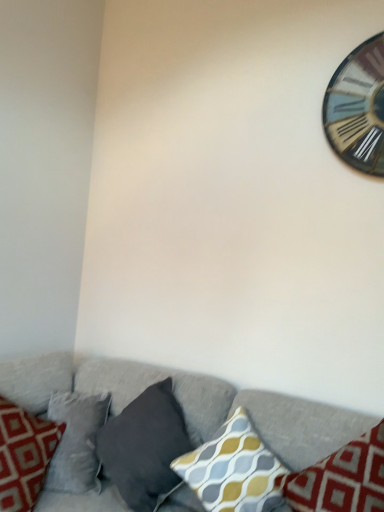
Question: Could you tell me if textured gray couch at lower center is turned towards wooden clock at upper right?

Choices:
 (A) no
 (B) yes

Answer: (A)

Question: Is textured gray couch at lower center to the left of wooden clock at upper right from the viewer's perspective?

Choices:
 (A) no
 (B) yes

Answer: (B)

Question: Considering the relative sizes of textured gray couch at lower center and wooden clock at upper right in the image provided, is textured gray couch at lower center taller than wooden clock at upper right?

Choices:
 (A) yes
 (B) no

Answer: (A)

Question: Is textured gray couch at lower center completely or partially outside of wooden clock at upper right?

Choices:
 (A) yes
 (B) no

Answer: (A)

Question: From a real-world perspective, is textured gray couch at lower center on top of wooden clock at upper right?

Choices:
 (A) no
 (B) yes

Answer: (A)

Question: Would you consider textured gray couch at lower center to be distant from wooden clock at upper right?

Choices:
 (A) no
 (B) yes

Answer: (B)

Question: Is wooden clock at upper right shorter than yellow-gray patterned cushion at center, the second pillow from the right?

Choices:
 (A) no
 (B) yes

Answer: (A)

Question: Is wooden clock at upper right facing away from yellow-gray patterned cushion at center, arranged as the second pillow when viewed from the left?

Choices:
 (A) no
 (B) yes

Answer: (A)

Question: Is the position of wooden clock at upper right less distant than that of yellow-gray patterned cushion at center, arranged as the second pillow when viewed from the left?

Choices:
 (A) yes
 (B) no

Answer: (B)

Question: Can you confirm if wooden clock at upper right is taller than yellow-gray patterned cushion at center, the second pillow from the right?

Choices:
 (A) no
 (B) yes

Answer: (B)

Question: Would you consider wooden clock at upper right to be distant from yellow-gray patterned cushion at center, the second pillow from the right?

Choices:
 (A) no
 (B) yes

Answer: (B)

Question: Is wooden clock at upper right facing towards yellow-gray patterned cushion at center, arranged as the second pillow when viewed from the left?

Choices:
 (A) no
 (B) yes

Answer: (A)

Question: Considering the relative positions of yellow-gray patterned cushion at center, the second pillow from the right, and dark gray fabric pillow at lower center, arranged as the 1th pillow when viewed from the left, in the image provided, is yellow-gray patterned cushion at center, the second pillow from the right, to the right of dark gray fabric pillow at lower center, arranged as the 1th pillow when viewed from the left, from the viewer's perspective?

Choices:
 (A) yes
 (B) no

Answer: (A)